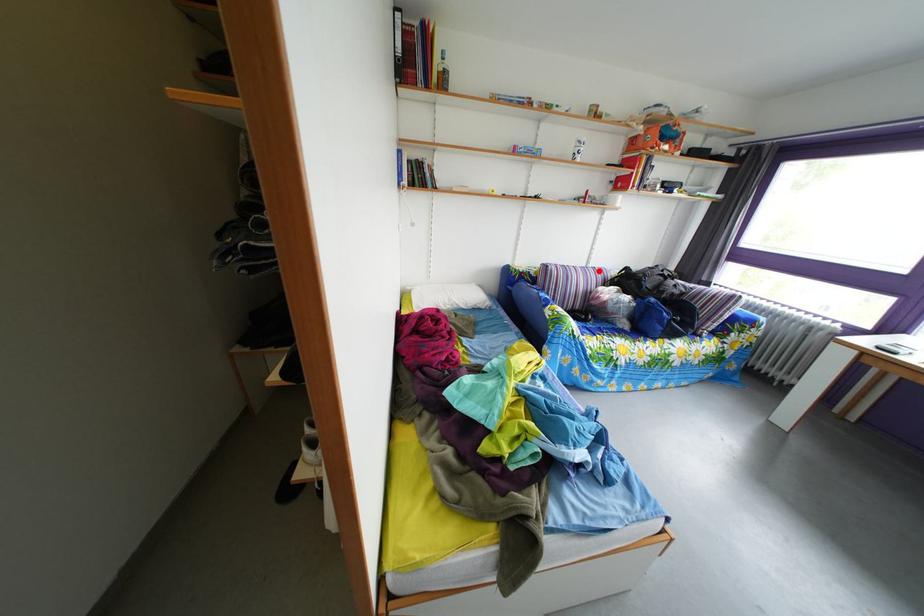
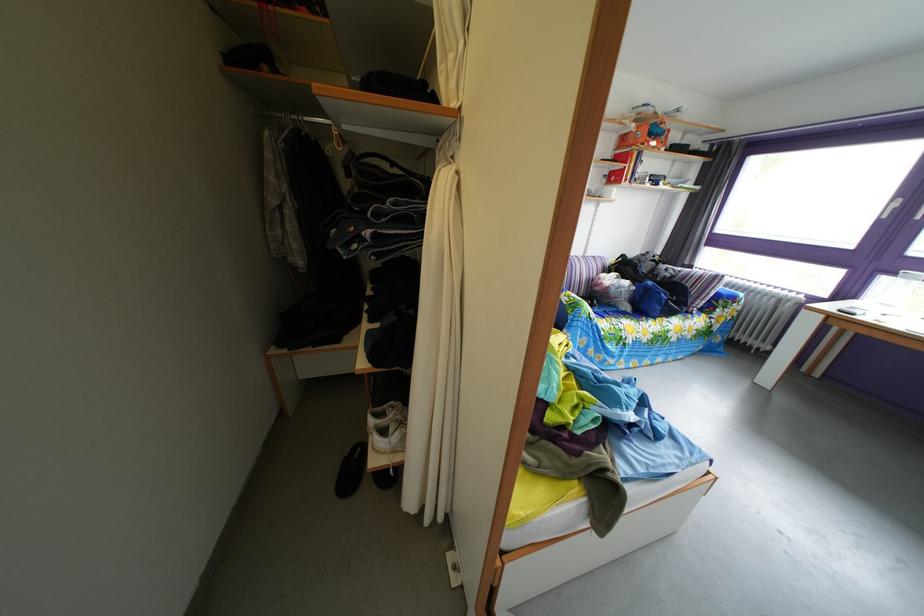
The point at the highlighted location is marked in the first image. Where is the corresponding point in the second image?

(596, 261)